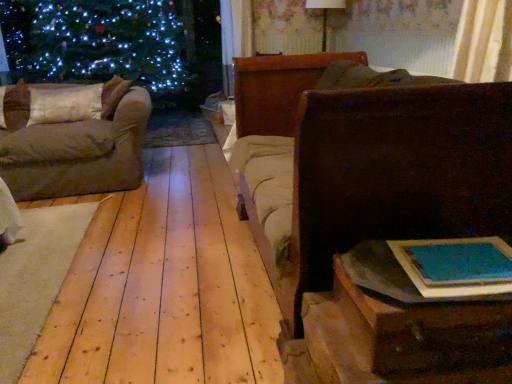
Image resolution: width=512 pixels, height=384 pixels. I want to click on free spot above blue paper book at lower right (from a real-world perspective), so click(x=465, y=254).